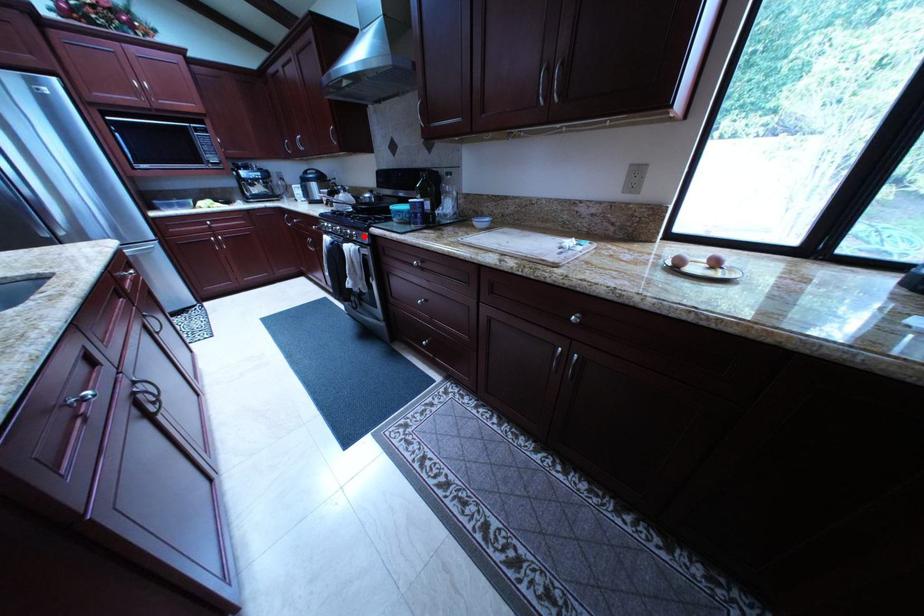
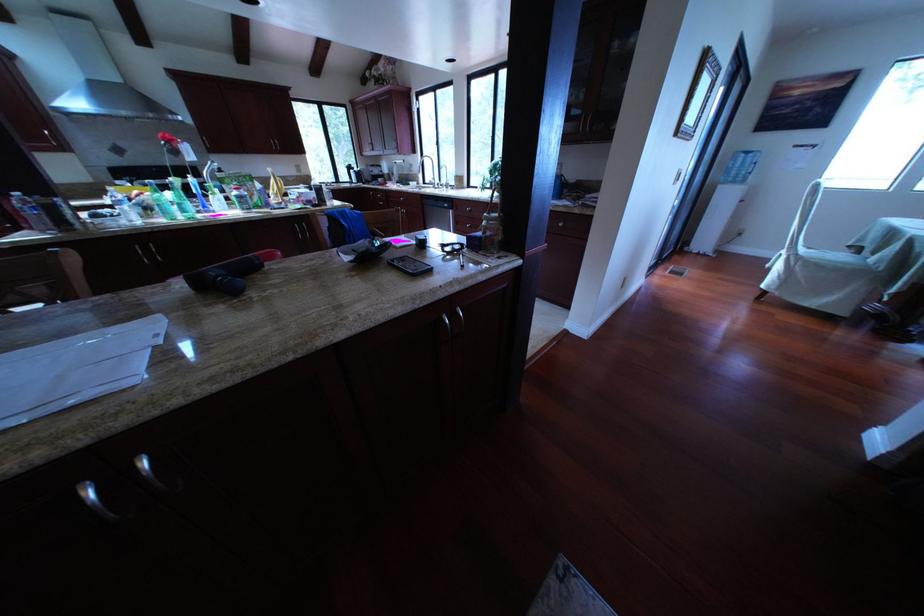
Question: I am providing you with two images of the same scene from different viewpoints. A red point is marked on the first image. At the location where the point appears in image 1, is it still visible in image 2?

Choices:
 (A) Yes
 (B) No

Answer: (B)